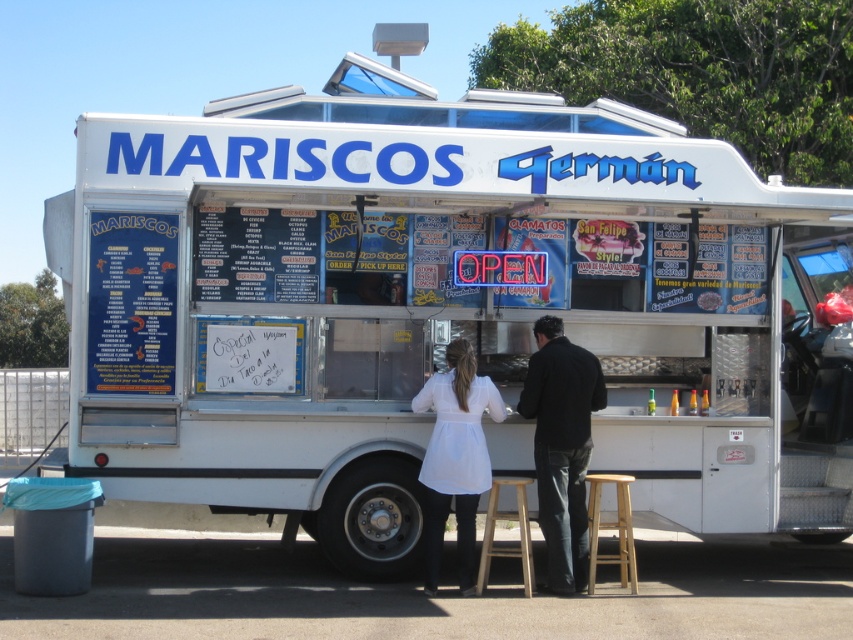
You are a customer standing at the food truck and want to order. The menu items are displayed at point (431,556) and the order window is at point (555,468). Which point should you approach to place your order?

The order window is at point (555,468). Since point (431,556) is in front of point (555,468), you should approach the order window at point (555,468) to place your order.